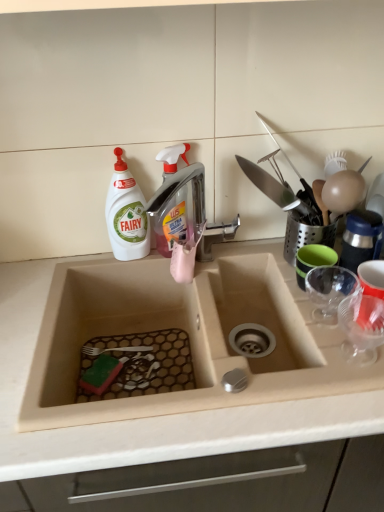
Image resolution: width=384 pixels, height=512 pixels. I want to click on free space on the front side of green rubber cup at right, positioned as the 3th tableware in front-to-back order, so click(325, 336).